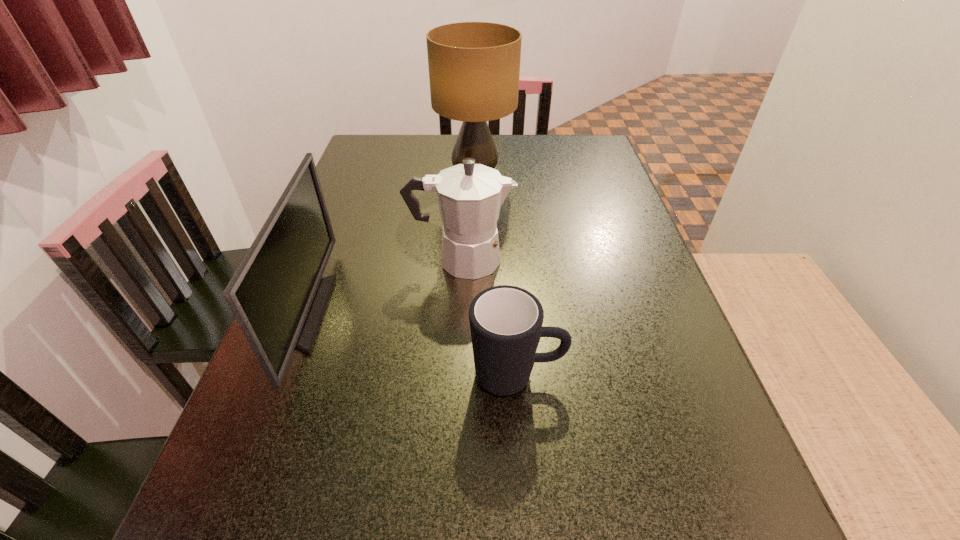
Find the location of a particular element. vacant area that lies between the leftmost object and the coffeepot is located at coordinates (383, 286).

This screenshot has height=540, width=960. Identify the location of free space between the leftmost object and the tallest object. (390, 245).

What are the coordinates of `empty space that is in between the shortest object and the lampshade` in the screenshot? It's located at (496, 275).

Identify which object is located as the second nearest to the mug. Please provide its 2D coordinates. Your answer should be formatted as a tuple, i.e. [(x, y)], where the tuple contains the x and y coordinates of a point satisfying the conditions above.

[(277, 295)]

Point out which object is positioned as the third nearest to the coffeepot. Please provide its 2D coordinates. Your answer should be formatted as a tuple, i.e. [(x, y)], where the tuple contains the x and y coordinates of a point satisfying the conditions above.

[(474, 67)]

Locate an element on the screen. vacant area that satisfies the following two spatial constraints: 1. on the front side of the farthest object; 2. at the spout of the coffeepot is located at coordinates (474, 259).